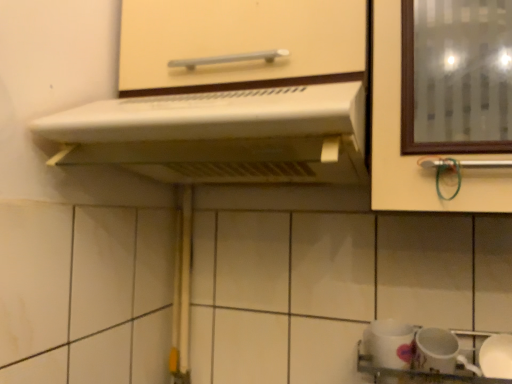
Question: Does white glossy sink at lower right have a greater height compared to matte white cabinet handle at upper center?

Choices:
 (A) no
 (B) yes

Answer: (A)

Question: Considering the relative sizes of white glossy sink at lower right and matte white cabinet handle at upper center in the image provided, is white glossy sink at lower right shorter than matte white cabinet handle at upper center?

Choices:
 (A) no
 (B) yes

Answer: (B)

Question: Is white glossy sink at lower right outside of matte white cabinet handle at upper center?

Choices:
 (A) yes
 (B) no

Answer: (A)

Question: Is the position of white glossy sink at lower right more distant than that of matte white cabinet handle at upper center?

Choices:
 (A) yes
 (B) no

Answer: (A)

Question: Is white glossy sink at lower right facing away from matte white cabinet handle at upper center?

Choices:
 (A) yes
 (B) no

Answer: (B)

Question: Does white glossy sink at lower right appear on the left side of matte white cabinet handle at upper center?

Choices:
 (A) yes
 (B) no

Answer: (B)

Question: Is white glossy sink at lower right bigger than white plastic range hood at upper center?

Choices:
 (A) yes
 (B) no

Answer: (B)

Question: From a real-world perspective, is white glossy sink at lower right positioned over white plastic range hood at upper center based on gravity?

Choices:
 (A) no
 (B) yes

Answer: (A)

Question: Is white glossy sink at lower right looking in the opposite direction of white plastic range hood at upper center?

Choices:
 (A) yes
 (B) no

Answer: (B)

Question: Is white glossy sink at lower right smaller than white plastic range hood at upper center?

Choices:
 (A) yes
 (B) no

Answer: (A)

Question: Considering the relative sizes of white glossy sink at lower right and white plastic range hood at upper center in the image provided, is white glossy sink at lower right thinner than white plastic range hood at upper center?

Choices:
 (A) no
 (B) yes

Answer: (B)

Question: From the image's perspective, is white glossy sink at lower right under white plastic range hood at upper center?

Choices:
 (A) no
 (B) yes

Answer: (B)

Question: Would you consider matte white cabinet handle at upper center to be distant from white glossy mug at lower right, arranged as the second tableware when viewed from the left?

Choices:
 (A) yes
 (B) no

Answer: (B)